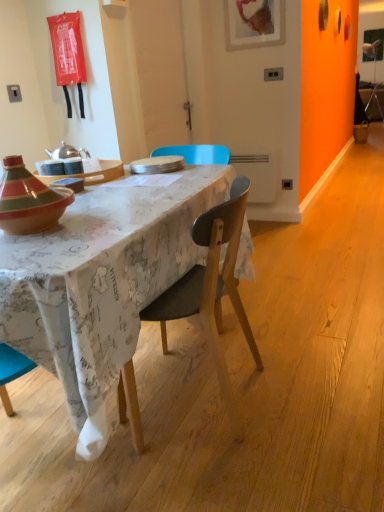
You are a GUI agent. You are given a task and a screenshot of the screen. Output one action in this format:
    pyautogui.click(x=<x>, y=<y>)
    Task: Click on the free spot to the right of wooden chair at center
    
    Given the screenshot: What is the action you would take?
    pyautogui.click(x=310, y=387)